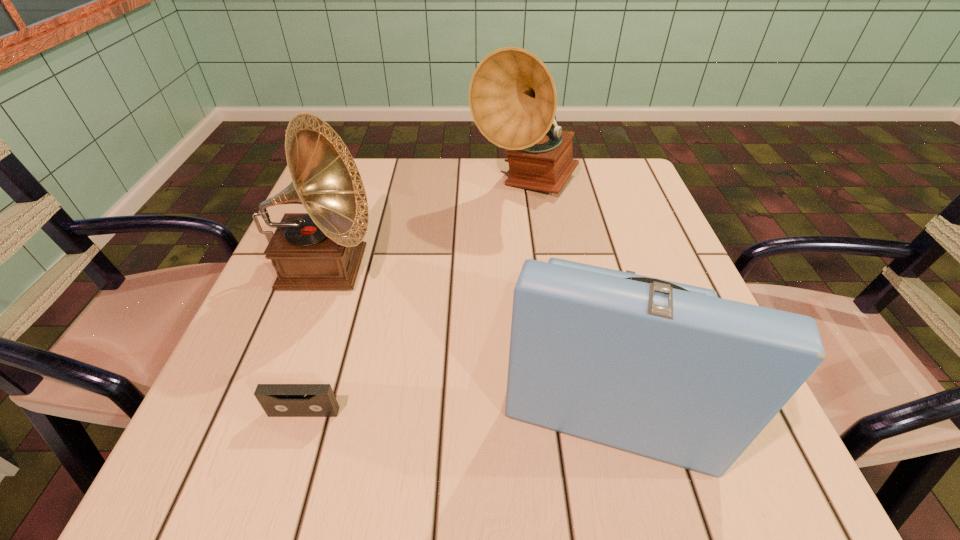
Find the location of a particular element. object at the near right corner is located at coordinates (668, 371).

Locate an element on the screen. This screenshot has width=960, height=540. free space at the far edge of the desktop is located at coordinates (432, 206).

This screenshot has height=540, width=960. What are the coordinates of `vacant space at the near edge of the desktop` in the screenshot? It's located at point(436,447).

Locate an element on the screen. The image size is (960, 540). vacant region at the left edge is located at coordinates (307, 334).

Identify the location of free space at the right edge of the desktop. [600, 238].

Locate an element on the screen. The height and width of the screenshot is (540, 960). free location at the near left corner of the desktop is located at coordinates (263, 437).

In the image, there is a desktop. At what (x,y) coordinates should I click in order to perform the action: click on free space at the far right corner. Please return your answer as a coordinate pair (x, y). Looking at the image, I should click on (589, 205).

Where is `free space between the farthest object and the videotape`? free space between the farthest object and the videotape is located at coordinates (415, 299).

This screenshot has height=540, width=960. What are the coordinates of `vacant space that is in between the leftmost phonograph record and the farthest object` in the screenshot? It's located at (425, 227).

I want to click on unoccupied area between the shortest object and the leftmost phonograph record, so click(x=315, y=340).